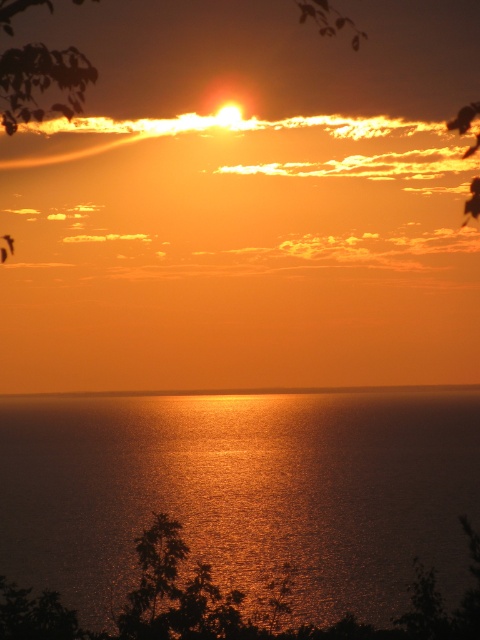
Describe the element at coordinates (241, 490) in the screenshot. This screenshot has width=480, height=640. I see `shiny golden water at center` at that location.

Does point (355, 451) lie behind point (166, 394)?

No.

What do you see at coordinates (241, 490) in the screenshot? The width and height of the screenshot is (480, 640). I see `shiny golden water at center` at bounding box center [241, 490].

The height and width of the screenshot is (640, 480). I want to click on shiny golden water at center, so click(x=241, y=490).